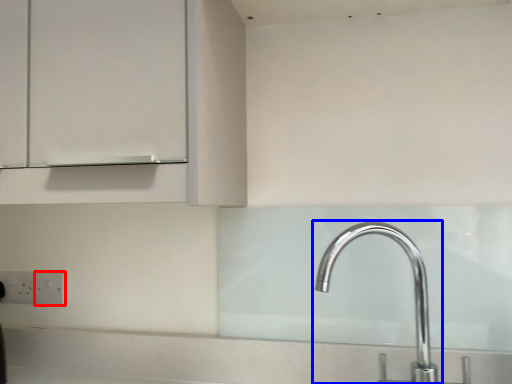
Question: Which point is further to the camera, electric outlet (highlighted by a red box) or tap (highlighted by a blue box)?

Choices:
 (A) electric outlet
 (B) tap

Answer: (A)